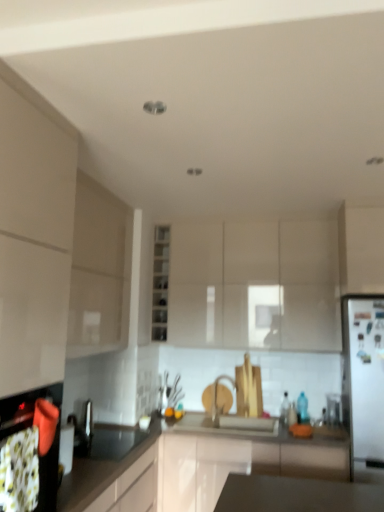
The image size is (384, 512). Identify the location of vacant point to the right of silver metallic faucet at center. (244, 420).